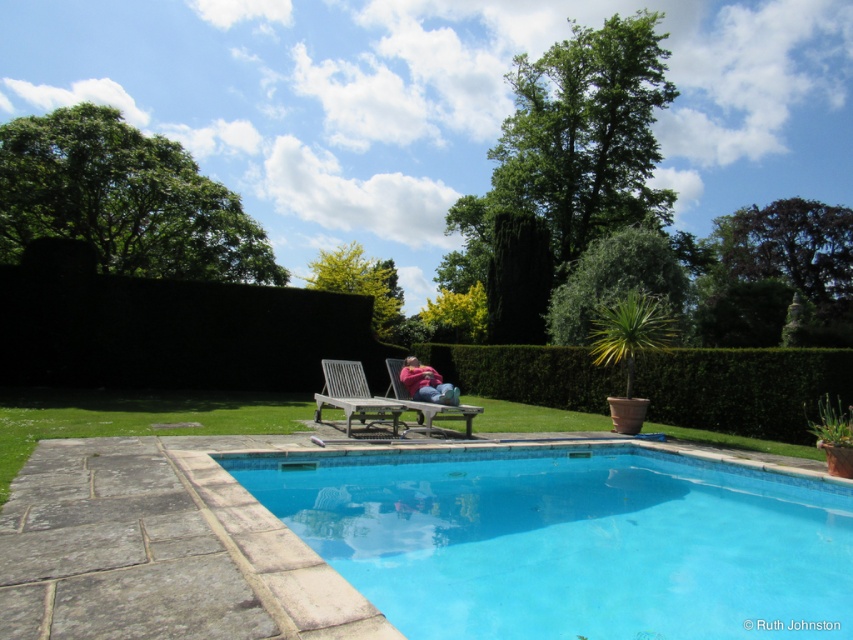
Is point (329, 388) less distant than point (409, 388)?

No.

From the picture: Is wooden slats lounge chair at center wider than pink fabric person at center?

Indeed, wooden slats lounge chair at center has a greater width compared to pink fabric person at center.

You are a GUI agent. You are given a task and a screenshot of the screen. Output one action in this format:
    pyautogui.click(x=<x>, y=<y>)
    Task: Click on the wooden slats lounge chair at center
    
    Given the screenshot: What is the action you would take?
    pyautogui.click(x=381, y=397)

Is point (718, 413) more distant than point (422, 364)?

No, (718, 413) is in front of (422, 364).

Between point (596, 369) and point (438, 397), which one is positioned in front?

Point (438, 397) is in front.

This screenshot has height=640, width=853. What are the coordinates of `green leafy hedge at center` in the screenshot? It's located at (743, 388).

Find the location of a particular element. green leafy hedge at center is located at coordinates (743, 388).

Between blue tile swimming pool at center and green leafy hedge at center, which one appears on the left side from the viewer's perspective?

blue tile swimming pool at center

How far apart are blue tile swimming pool at center and green leafy hedge at center?

They are 8.48 meters apart.

Measure the distance between point [354,468] and camera.

The distance of point [354,468] from camera is 7.02 meters.

Locate an element on the screen. This screenshot has height=640, width=853. blue tile swimming pool at center is located at coordinates (569, 540).